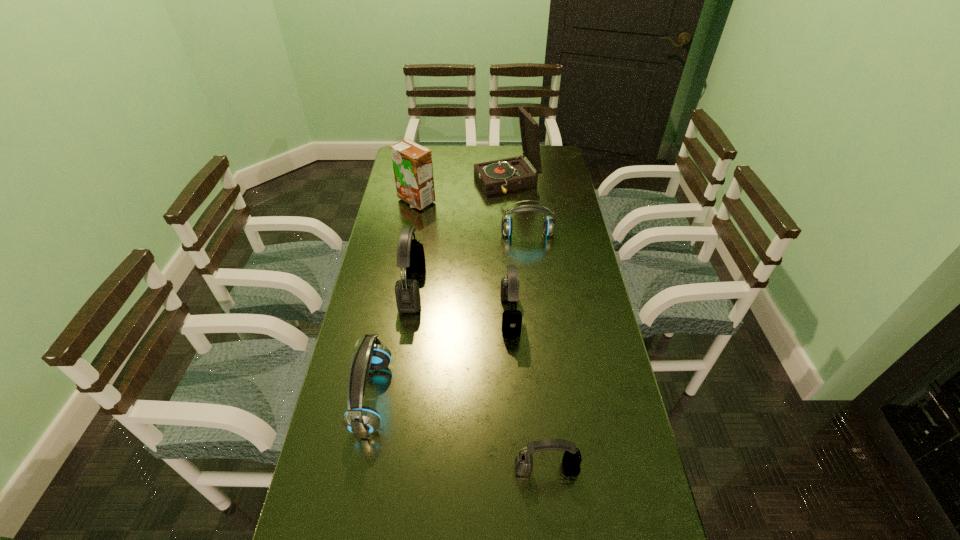
Locate an element on the screen. Image resolution: width=960 pixels, height=540 pixels. phonograph record is located at coordinates (499, 176).

Locate an element on the screen. The height and width of the screenshot is (540, 960). carton is located at coordinates (412, 163).

The width and height of the screenshot is (960, 540). In order to click on the tallest headset in this screenshot , I will do `click(410, 253)`.

Locate an element on the screen. The image size is (960, 540). the biggest black headset is located at coordinates (410, 253).

Locate an element on the screen. the second smallest black headset is located at coordinates (509, 291).

Where is `the nearer blue headset`? Image resolution: width=960 pixels, height=540 pixels. the nearer blue headset is located at coordinates (362, 421).

Locate an element on the screen. the sixth farthest object is located at coordinates tap(362, 421).

The width and height of the screenshot is (960, 540). Find the location of `the farther blue headset`. the farther blue headset is located at coordinates pyautogui.click(x=549, y=225).

Identify the location of the farthest headset. (549, 225).

At what (x,y) coordinates should I click in order to perform the action: click on the nearest object. Please return your answer as a coordinate pair (x, y). Looking at the image, I should click on (571, 461).